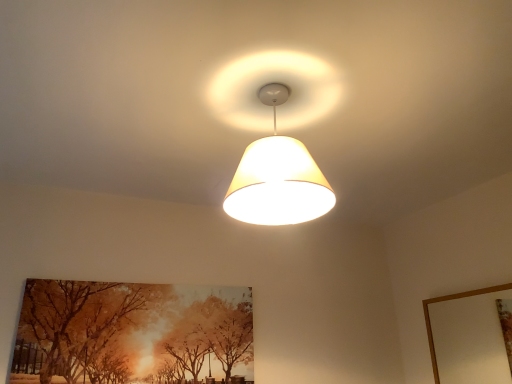
Question: Does matte white lampshade at center appear on the right side of orange painted canvas at lower left?

Choices:
 (A) yes
 (B) no

Answer: (A)

Question: Is matte white lampshade at center far from orange painted canvas at lower left?

Choices:
 (A) no
 (B) yes

Answer: (B)

Question: From the image's perspective, is matte white lampshade at center under orange painted canvas at lower left?

Choices:
 (A) yes
 (B) no

Answer: (B)

Question: Considering the relative sizes of matte white lampshade at center and orange painted canvas at lower left in the image provided, is matte white lampshade at center thinner than orange painted canvas at lower left?

Choices:
 (A) no
 (B) yes

Answer: (A)

Question: Does matte white lampshade at center lie behind orange painted canvas at lower left?

Choices:
 (A) yes
 (B) no

Answer: (B)

Question: Does matte white lampshade at center come in front of orange painted canvas at lower left?

Choices:
 (A) no
 (B) yes

Answer: (B)

Question: Is wooden picture frame at upper right positioned beyond the bounds of matte white lampshade at center?

Choices:
 (A) no
 (B) yes

Answer: (B)

Question: From the image's perspective, would you say wooden picture frame at upper right is shown under matte white lampshade at center?

Choices:
 (A) yes
 (B) no

Answer: (A)

Question: Is wooden picture frame at upper right aimed at matte white lampshade at center?

Choices:
 (A) no
 (B) yes

Answer: (B)

Question: From the image's perspective, is wooden picture frame at upper right on matte white lampshade at center?

Choices:
 (A) yes
 (B) no

Answer: (B)

Question: From a real-world perspective, is wooden picture frame at upper right below matte white lampshade at center?

Choices:
 (A) yes
 (B) no

Answer: (A)

Question: Is wooden picture frame at upper right looking in the opposite direction of matte white lampshade at center?

Choices:
 (A) yes
 (B) no

Answer: (B)

Question: Is wooden picture frame at upper right touching orange painted canvas at lower left?

Choices:
 (A) no
 (B) yes

Answer: (A)